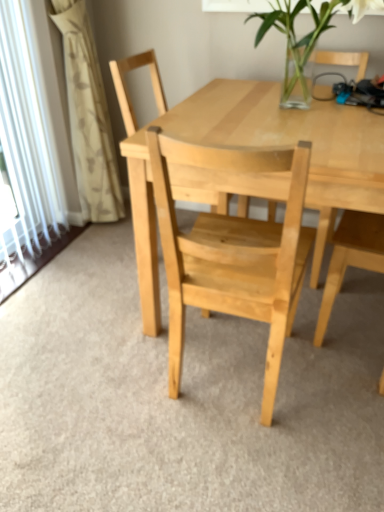
Locate an element on the screen. free area below clear glass vase at upper center (from a real-world perspective) is located at coordinates (304, 106).